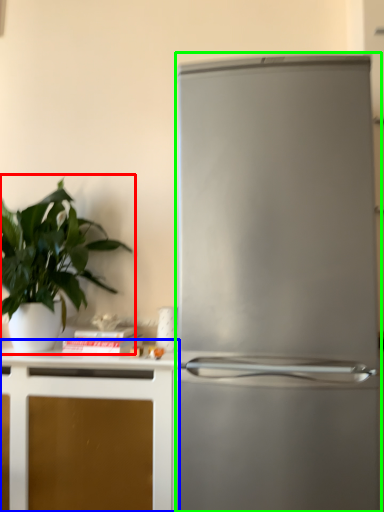
Question: Considering the real-world distances, which object is farthest from houseplant (highlighted by a red box)? cabinetry (highlighted by a blue box) or refrigerator (highlighted by a green box)?

Choices:
 (A) cabinetry
 (B) refrigerator

Answer: (B)